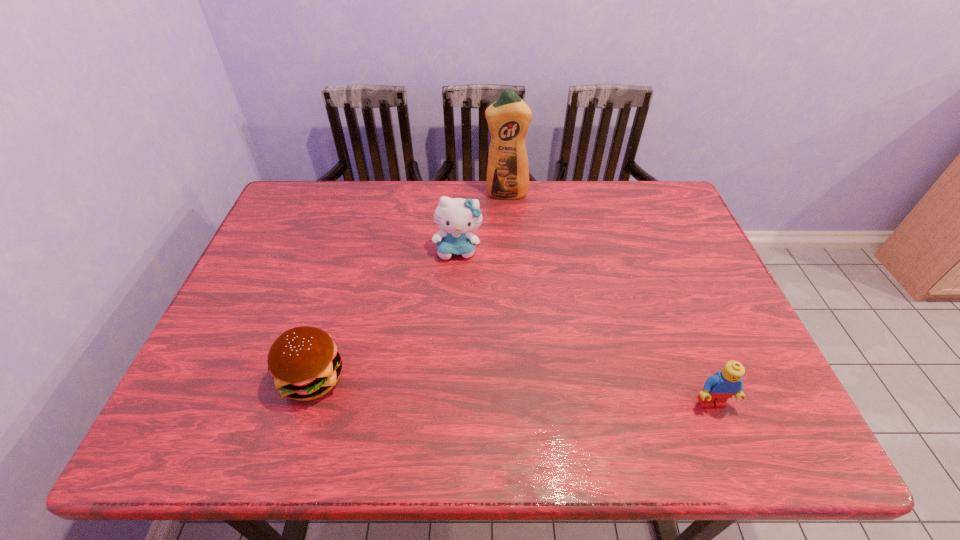
Find the location of a particular element. The height and width of the screenshot is (540, 960). free space located 0.320m on the label of the detergent is located at coordinates (511, 272).

Where is `vacant point located 0.380m on the label of the detergent`? The height and width of the screenshot is (540, 960). vacant point located 0.380m on the label of the detergent is located at coordinates (512, 288).

Locate an element on the screen. vacant area situated on the label of the detergent is located at coordinates (509, 245).

Locate an element on the screen. Image resolution: width=960 pixels, height=540 pixels. object at the far edge is located at coordinates (508, 118).

Identify the location of hamburger positioned at the near edge. The height and width of the screenshot is (540, 960). (304, 362).

Locate an element on the screen. Lego at the near edge is located at coordinates (724, 384).

At what (x,y) coordinates should I click in order to perform the action: click on object that is at the right edge. Please return your answer as a coordinate pair (x, y). The height and width of the screenshot is (540, 960). Looking at the image, I should click on (724, 384).

The width and height of the screenshot is (960, 540). In order to click on object situated at the near right corner in this screenshot , I will do `click(724, 384)`.

In order to click on free spot at the far edge of the desktop in this screenshot , I will do `click(345, 199)`.

I want to click on vacant region at the near edge of the desktop, so (580, 368).